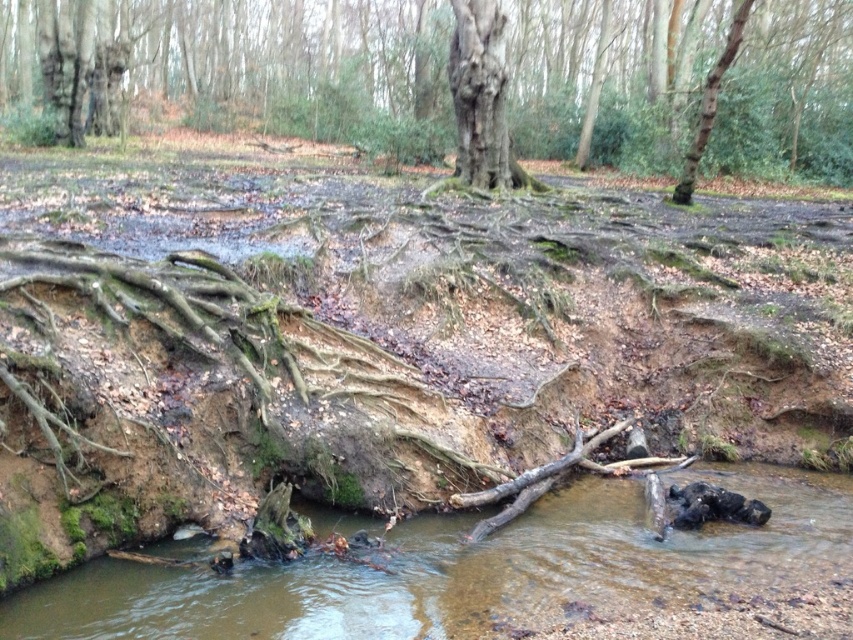
You are a hiker trying to cross the stream in the woodland scene. You see two points marked on the stream bank. The first point is at coordinates point (310, 592) and the second is at point (712, 109). Which point should you choose to step on first if you want to move towards the far side of the stream?

You should step on point (310, 592) first because it is in front of point (712, 109), making it closer to the far side of the stream.

You are a hiker trying to cross the stream. You see the brown muddy stream at lower center and the smooth bark tree trunk at center. Which one is shorter in height?

The brown muddy stream at lower center is not as tall as the smooth bark tree trunk at center, so the brown muddy stream at lower center is shorter in height.

You are a hiker trying to cross the stream in the woodland scene. You see the rough bark tree at center and the brown rough bark tree trunk at upper right. Which tree should you head towards if you want to cross the stream closer to the right side of the image?

The brown rough bark tree trunk at upper right is located on the right side of the image, so heading towards it would allow you to cross the stream closer to the right side.